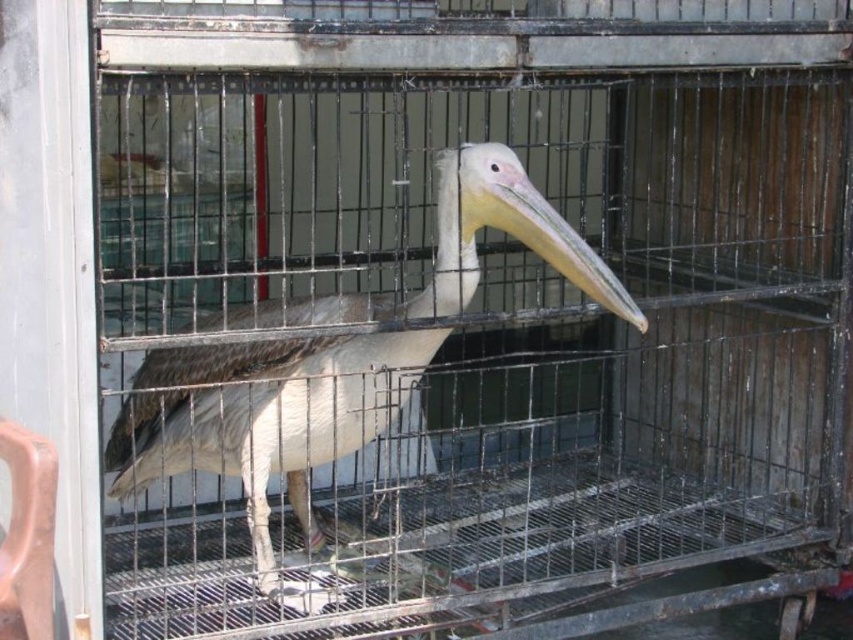
Between point (181, 413) and point (550, 237), which one is positioned in front?

Point (550, 237) is in front.

Which is behind, point (567, 241) or point (561, 234)?

Point (561, 234)

Is point (152, 394) behind point (544, 212)?

That is True.

I want to click on grayish-brown feathers at center, so click(x=264, y=420).